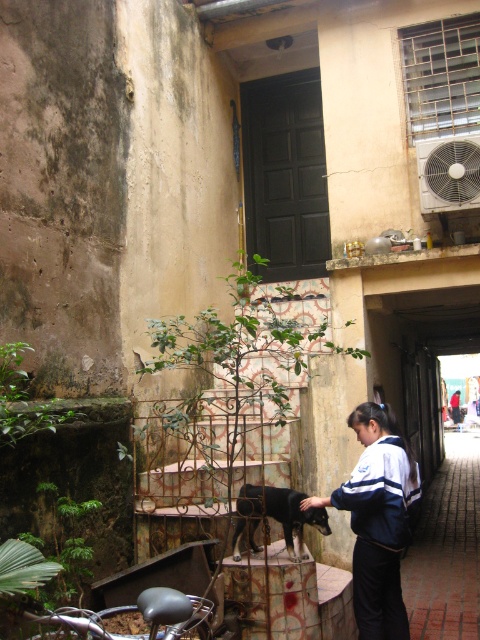
Question: Which of the following is the closest to the observer?

Choices:
 (A) dark blue uniform at center
 (B) white plastic air conditioner at upper right
 (C) black fur dog at center
 (D) dark blue uniform at lower right

Answer: (C)

Question: Where is black fur dog at center located in relation to dark blue uniform at center in the image?

Choices:
 (A) below
 (B) above

Answer: (B)

Question: Can you confirm if dark blue uniform at lower right is positioned to the left of black fur dog at center?

Choices:
 (A) no
 (B) yes

Answer: (A)

Question: Which point appears closest to the camera in this image?

Choices:
 (A) coord(470,552)
 (B) coord(247,500)
 (C) coord(412,474)

Answer: (B)

Question: Which object appears farthest from the camera in this image?

Choices:
 (A) black fur dog at center
 (B) blue-and-white jacket at center

Answer: (A)

Question: Does dark blue uniform at lower right have a larger size compared to black fur dog at center?

Choices:
 (A) no
 (B) yes

Answer: (B)